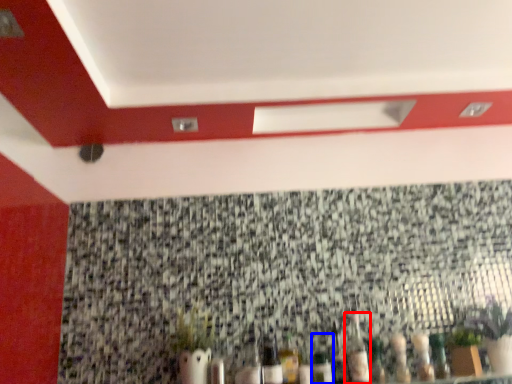
Question: Which object appears farthest to the camera in this image, bottle (highlighted by a red box) or bottle (highlighted by a blue box)?

Choices:
 (A) bottle
 (B) bottle

Answer: (A)